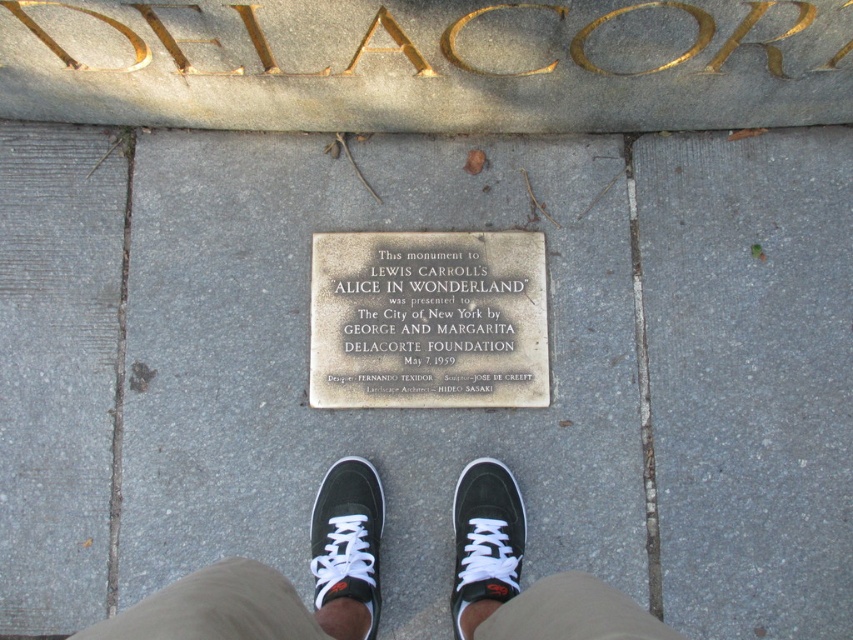
Can you confirm if black fabric pants at lower center is wider than black suede sneaker at center?

Yes.

Does point (335, 474) come in front of point (325, 545)?

That is False.

At what (x,y) coordinates should I click in order to perform the action: click on black fabric pants at lower center. Please return your answer as a coordinate pair (x, y). The height and width of the screenshot is (640, 853). Looking at the image, I should click on (279, 579).

Is black fabric pants at lower center bigger than silver metallic plaque at center?

Indeed, black fabric pants at lower center has a larger size compared to silver metallic plaque at center.

Between black fabric pants at lower center and silver metallic plaque at center, which one has more height?

silver metallic plaque at center is taller.

Locate an element on the screen. The image size is (853, 640). black fabric pants at lower center is located at coordinates (279, 579).

Who is lower down, black fabric pants at lower center or black matte sneaker at lower center?

black matte sneaker at lower center is lower down.

Consider the image. Who is positioned more to the left, black fabric pants at lower center or black matte sneaker at lower center?

black fabric pants at lower center is more to the left.

Between point (169, 609) and point (463, 472), which one is positioned in front?

Point (169, 609) is more forward.

Identify the location of black fabric pants at lower center. (279, 579).